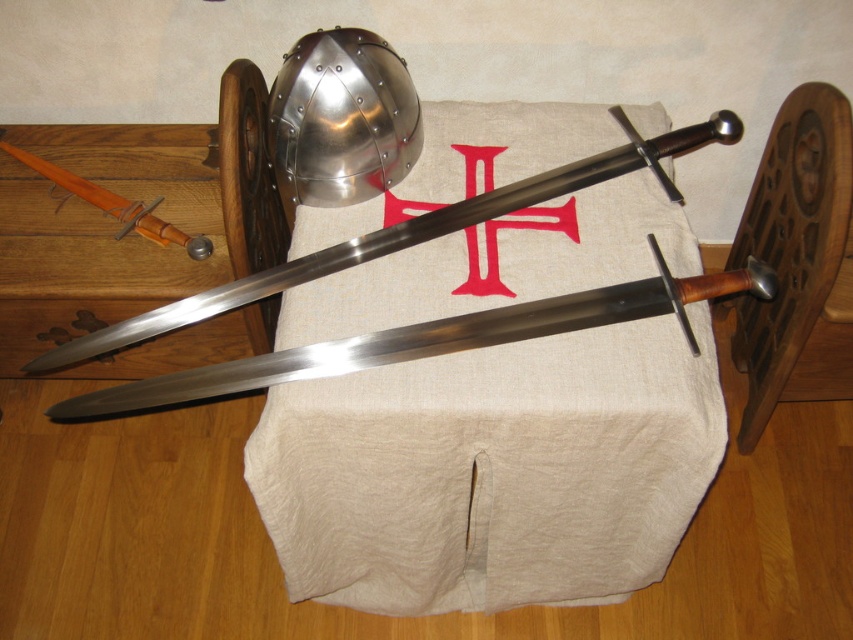
Question: Which point is farther to the camera?

Choices:
 (A) polished steel sword at center
 (B) shiny metallic helmet at upper center
 (C) beige linen tablecloth at center

Answer: (A)

Question: Does polished steel sword at center have a greater width compared to polished wood sword at upper left?

Choices:
 (A) no
 (B) yes

Answer: (B)

Question: Which point is closer to the camera taking this photo?

Choices:
 (A) (239, 280)
 (B) (128, 208)
 (C) (289, 72)

Answer: (C)

Question: Estimate the real-world distances between objects in this image. Which object is closer to the beige linen tablecloth at center?

Choices:
 (A) polished metal sword at center
 (B) shiny metallic helmet at upper center
 (C) polished steel sword at center

Answer: (A)

Question: Observing the image, what is the correct spatial positioning of beige linen tablecloth at center in reference to polished metal sword at center?

Choices:
 (A) above
 (B) below

Answer: (B)

Question: Does beige linen tablecloth at center have a lesser width compared to polished wood sword at upper left?

Choices:
 (A) yes
 (B) no

Answer: (B)